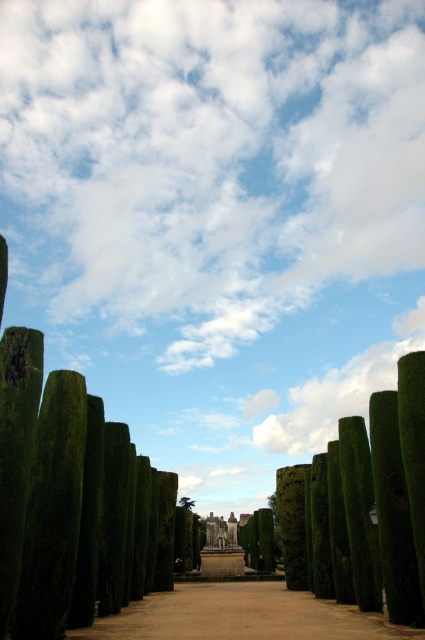
Find the location of a particular element. This screenshot has height=640, width=425. brown dirt path at center is located at coordinates (240, 616).

Identify the location of brown dirt path at center. The image size is (425, 640). (240, 616).

Find the location of a particular element. The width and height of the screenshot is (425, 640). brown dirt path at center is located at coordinates (240, 616).